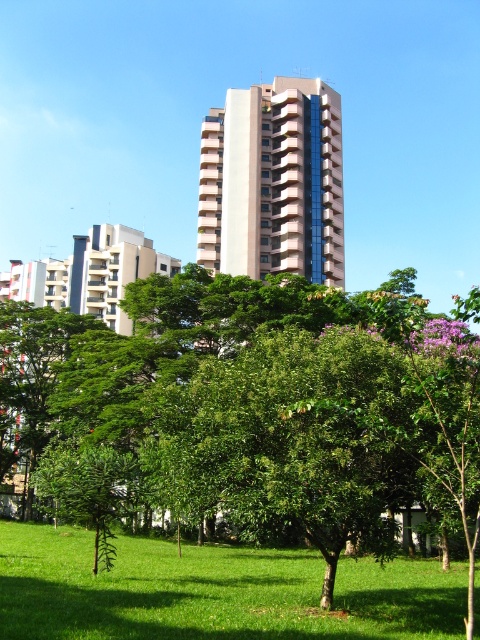
Question: Does green grass at lower center lie behind white glossy building at center?

Choices:
 (A) no
 (B) yes

Answer: (A)

Question: Which point is closer to the camera taking this photo?

Choices:
 (A) (50, 403)
 (B) (298, 620)
 (C) (277, 269)

Answer: (B)

Question: Is green leafy tree at center further to the viewer compared to white glossy building at center?

Choices:
 (A) no
 (B) yes

Answer: (A)

Question: Among these objects, which one is nearest to the camera?

Choices:
 (A) white glossy building at center
 (B) green grass at lower center
 (C) green leafy tree at center

Answer: (C)

Question: In this image, where is green leafy tree at center located relative to green grass at lower center?

Choices:
 (A) right
 (B) left

Answer: (A)

Question: Which point is closer to the camera?

Choices:
 (A) green grass at lower center
 (B) green leafy tree at center

Answer: (B)